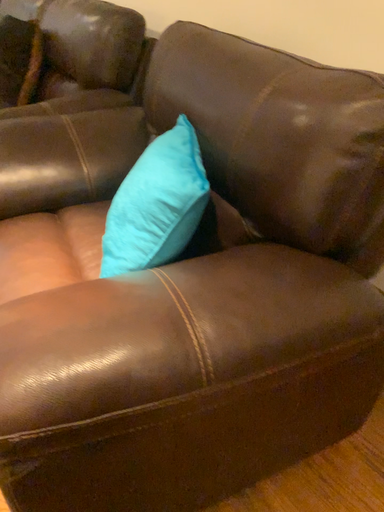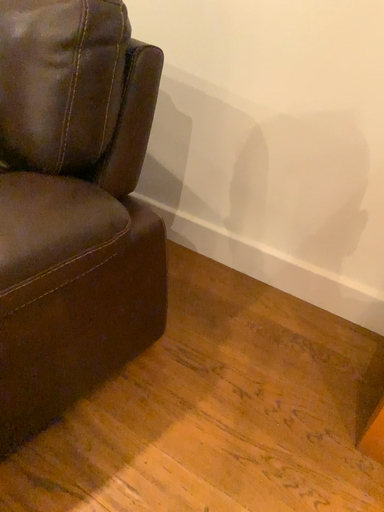
Question: How did the camera likely rotate when shooting the video?

Choices:
 (A) rotated left
 (B) rotated right

Answer: (B)